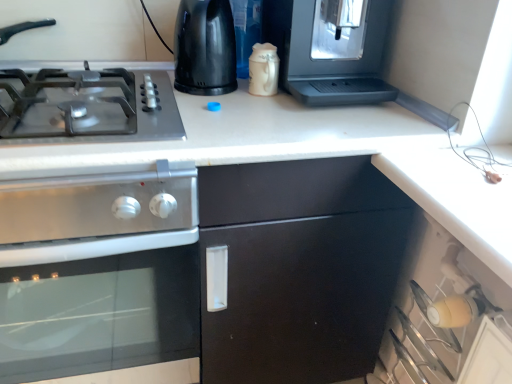
Question: Is metallic gray gas stove at left taller than satin silver coffee machine at upper right, which is counted as the 2th appliance, starting from the left?

Choices:
 (A) yes
 (B) no

Answer: (B)

Question: Can you confirm if metallic gray gas stove at left is smaller than satin silver coffee machine at upper right, which is counted as the 2th appliance, starting from the left?

Choices:
 (A) no
 (B) yes

Answer: (B)

Question: Does metallic gray gas stove at left contain satin silver coffee machine at upper right, arranged as the first appliance when viewed from the right?

Choices:
 (A) no
 (B) yes

Answer: (A)

Question: Does metallic gray gas stove at left have a lesser height compared to satin silver coffee machine at upper right, which is counted as the 2th appliance, starting from the left?

Choices:
 (A) no
 (B) yes

Answer: (B)

Question: Is metallic gray gas stove at left at the right side of satin silver coffee machine at upper right, arranged as the first appliance when viewed from the right?

Choices:
 (A) yes
 (B) no

Answer: (B)

Question: Is satin silver coffee machine at upper right, which is counted as the 2th appliance, starting from the left, to the left or to the right of stainless steel oven at left in the image?

Choices:
 (A) left
 (B) right

Answer: (B)

Question: Considering the positions of satin silver coffee machine at upper right, which is counted as the 2th appliance, starting from the left, and stainless steel oven at left in the image, is satin silver coffee machine at upper right, which is counted as the 2th appliance, starting from the left, bigger or smaller than stainless steel oven at left?

Choices:
 (A) big
 (B) small

Answer: (B)

Question: From the image's perspective, is satin silver coffee machine at upper right, arranged as the first appliance when viewed from the right, positioned above or below stainless steel oven at left?

Choices:
 (A) above
 (B) below

Answer: (A)

Question: Considering their positions, is satin silver coffee machine at upper right, which is counted as the 2th appliance, starting from the left, located in front of or behind stainless steel oven at left?

Choices:
 (A) front
 (B) behind

Answer: (B)

Question: Considering the relative positions of stainless steel oven at left and satin silver coffee machine at upper right, arranged as the first appliance when viewed from the right, in the image provided, is stainless steel oven at left to the left or to the right of satin silver coffee machine at upper right, arranged as the first appliance when viewed from the right,?

Choices:
 (A) left
 (B) right

Answer: (A)

Question: In terms of size, does stainless steel oven at left appear bigger or smaller than satin silver coffee machine at upper right, which is counted as the 2th appliance, starting from the left?

Choices:
 (A) small
 (B) big

Answer: (B)

Question: Do you think stainless steel oven at left is within satin silver coffee machine at upper right, arranged as the first appliance when viewed from the right, or outside of it?

Choices:
 (A) outside
 (B) inside

Answer: (A)

Question: From a real-world perspective, relative to satin silver coffee machine at upper right, arranged as the first appliance when viewed from the right, is stainless steel oven at left vertically above or below?

Choices:
 (A) above
 (B) below

Answer: (B)

Question: Considering their positions, is black plastic kettle at upper center, marked as the first appliance in a left-to-right arrangement, located in front of or behind satin silver coffee machine at upper right, arranged as the first appliance when viewed from the right?

Choices:
 (A) behind
 (B) front

Answer: (A)

Question: Visually, is black plastic kettle at upper center, marked as the first appliance in a left-to-right arrangement, positioned to the left or to the right of satin silver coffee machine at upper right, which is counted as the 2th appliance, starting from the left?

Choices:
 (A) left
 (B) right

Answer: (A)